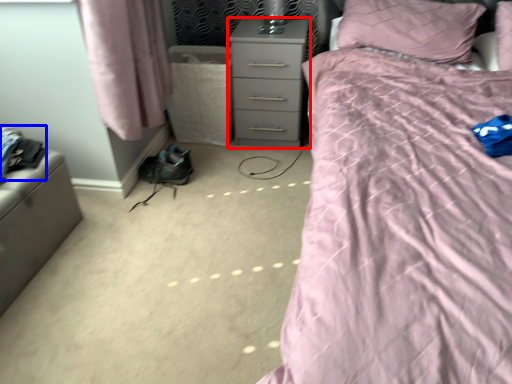
Question: Which of the following is the closest to the observer, nightstand (highlighted by a red box) or clothing (highlighted by a blue box)?

Choices:
 (A) nightstand
 (B) clothing

Answer: (B)